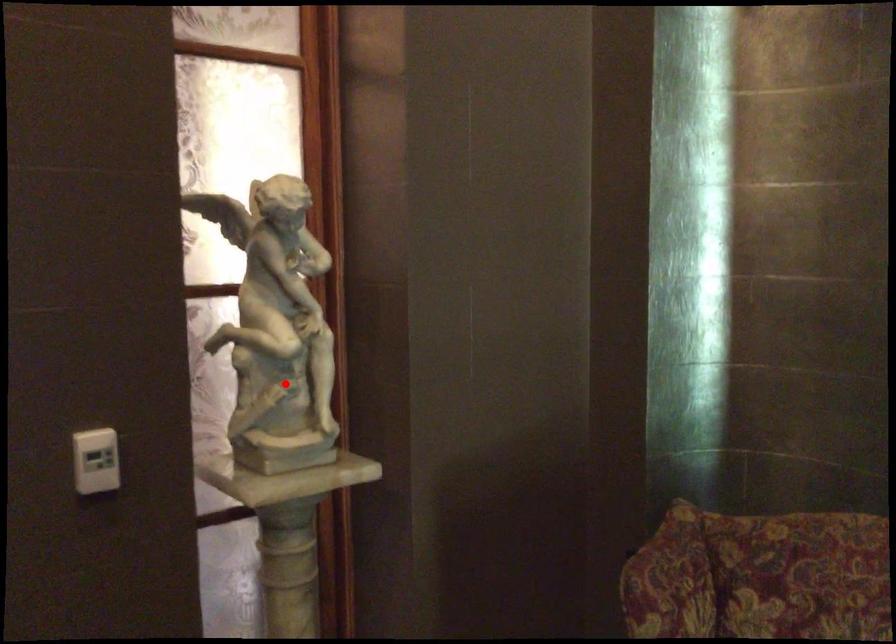
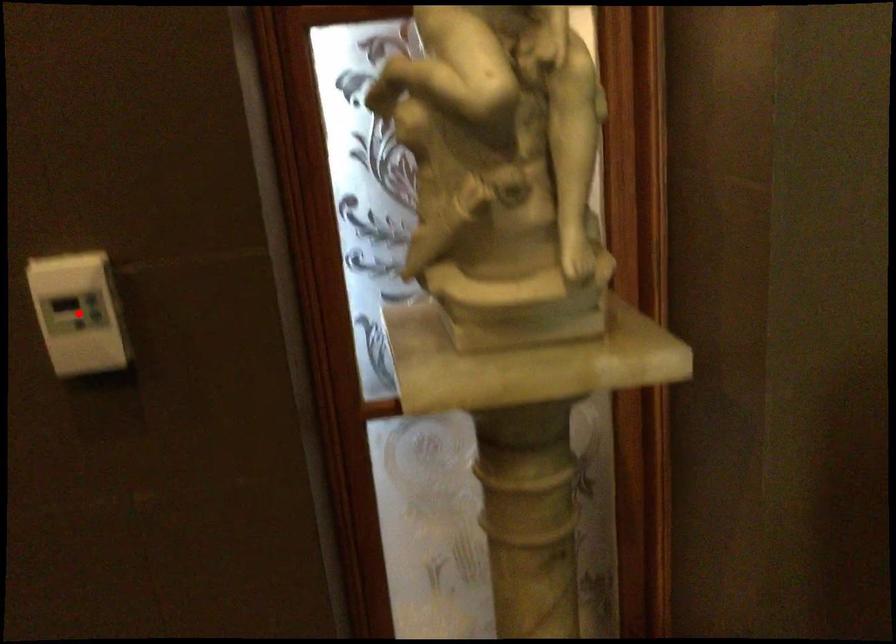
I am providing you with two images of the same scene from different viewpoints. A red point is marked on the first image and another point is marked on the second image. Do the highlighted points in image1 and image2 indicate the same real-world spot?

No